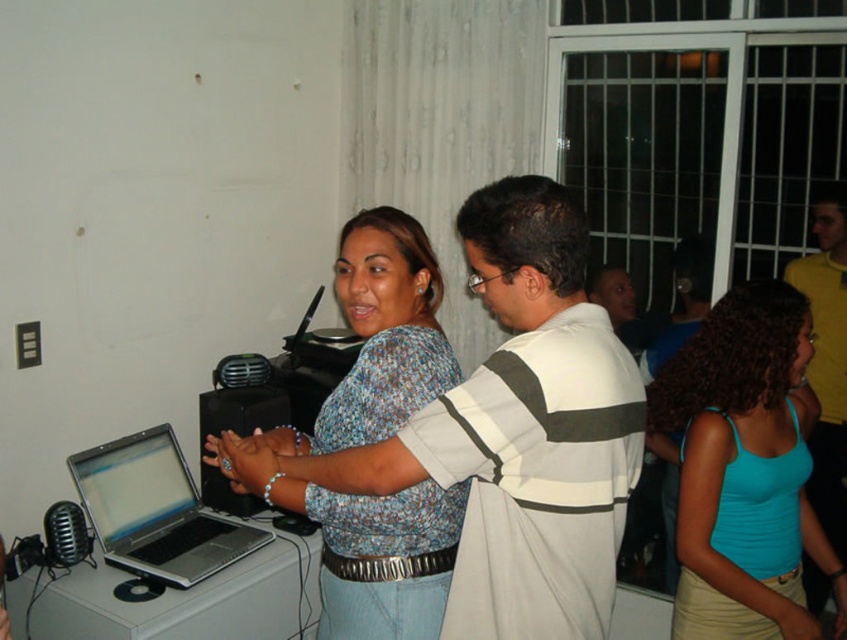
Looking at this image, can you confirm if white striped shirt at center is smaller than teal fabric tank top at center?

Indeed, white striped shirt at center has a smaller size compared to teal fabric tank top at center.

Is point (540, 224) less distant than point (748, 344)?

That is True.

Consider the image. Measure the distance between point (518, 468) and camera.

Point (518, 468) and camera are 1.25 meters apart from each other.

In order to click on white striped shirt at center in this screenshot , I will do `click(516, 432)`.

Does point (699, 483) come farther from viewer compared to point (248, 429)?

No.

This screenshot has width=847, height=640. Identify the location of teal fabric tank top at center. (745, 468).

Locate an element on the screen. teal fabric tank top at center is located at coordinates (745, 468).

Is silver/black laptop at left behind black glossy laptop at center?

No, silver/black laptop at left is in front of black glossy laptop at center.

Does silver/black laptop at left have a greater height compared to black glossy laptop at center?

Incorrect, silver/black laptop at left's height is not larger of black glossy laptop at center's.

Which is behind, point (120, 460) or point (257, 417)?

The point (257, 417) is behind.

Find the location of a particular element. This screenshot has height=640, width=847. silver/black laptop at left is located at coordinates (156, 509).